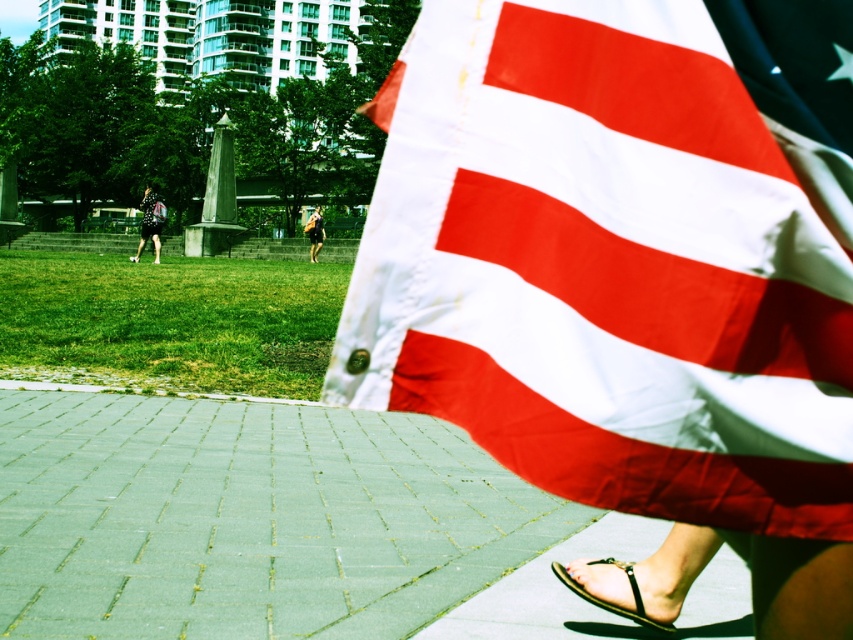
Who is taller, red and white striped fabric at right or camouflage-patterned backpack at center?

camouflage-patterned backpack at center

Is red and white striped fabric at right in front of camouflage-patterned backpack at center?

Yes.

Is point (627, 115) positioned behind point (309, 259)?

No, (627, 115) is closer to viewer.

You are a GUI agent. You are given a task and a screenshot of the screen. Output one action in this format:
    pyautogui.click(x=<x>, y=<y>)
    Task: Click on the red and white striped fabric at right
    
    Given the screenshot: What is the action you would take?
    pyautogui.click(x=602, y=269)

Is dark blue jeans at lower left shorter than camouflage-patterned backpack at center?

No, dark blue jeans at lower left is not shorter than camouflage-patterned backpack at center.

Between point (132, 256) and point (318, 230), which one is positioned behind?

Point (132, 256)

Where is `dark blue jeans at lower left`? The height and width of the screenshot is (640, 853). dark blue jeans at lower left is located at coordinates (149, 224).

Is black fabric sandal at lower right shorter than dark blue jeans at lower left?

Yes, black fabric sandal at lower right is shorter than dark blue jeans at lower left.

Does point (637, 598) lie behind point (141, 230)?

No, (637, 598) is in front of (141, 230).

The height and width of the screenshot is (640, 853). I want to click on black fabric sandal at lower right, so click(610, 602).